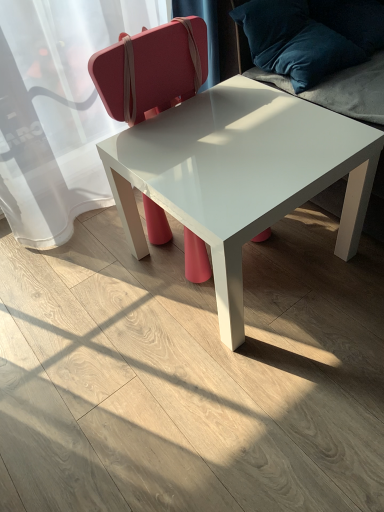
Identify the location of vacant space situated on the left part of matte pink suitcase at center. This screenshot has height=512, width=384. (104, 264).